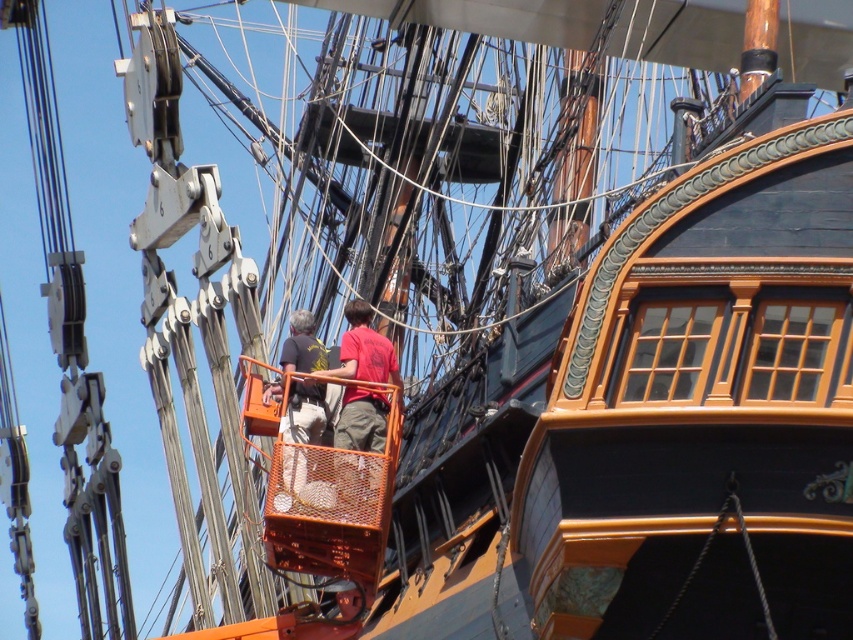
This screenshot has height=640, width=853. I want to click on dark gray fabric shirt at center, so click(305, 413).

Who is positioned more to the right, dark gray fabric shirt at center or red matte shirt at center?

From the viewer's perspective, red matte shirt at center appears more on the right side.

The width and height of the screenshot is (853, 640). Find the location of `dark gray fabric shirt at center`. dark gray fabric shirt at center is located at coordinates (305, 413).

You are a GUI agent. You are given a task and a screenshot of the screen. Output one action in this format:
    pyautogui.click(x=<x>, y=<y>)
    Task: Click on the dark gray fabric shirt at center
    This screenshot has height=640, width=853.
    Given the screenshot: What is the action you would take?
    pyautogui.click(x=305, y=413)